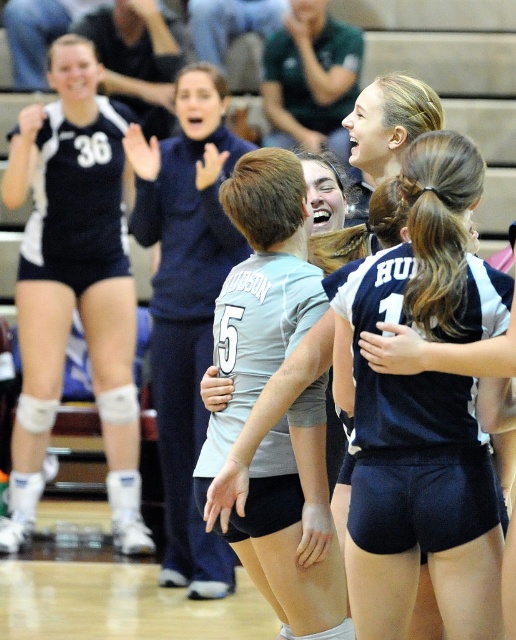
Is matte black uniform at center closer to the viewer compared to matte blue sweatshirt at center?

No, matte black uniform at center is further to the viewer.

The height and width of the screenshot is (640, 516). I want to click on matte black uniform at center, so click(73, 284).

Is point (112, 173) positioned after point (181, 104)?

Yes, it is.

In order to click on matte black uniform at center in this screenshot , I will do `click(73, 284)`.

Does matte black uniform at center appear over light gray jersey at center?

Indeed, matte black uniform at center is positioned over light gray jersey at center.

Does matte black uniform at center have a greater height compared to light gray jersey at center?

Yes.

Does point (27, 374) come behind point (383, 403)?

Yes, point (27, 374) is behind point (383, 403).

At what (x,y) coordinates should I click in order to perform the action: click on matte black uniform at center. Please return your answer as a coordinate pair (x, y). This screenshot has width=516, height=640. Looking at the image, I should click on (73, 284).

This screenshot has height=640, width=516. Identify the location of light gray jersey at center. (421, 304).

Is light gray jersey at center positioned behind matte blue sweatshirt at center?

No.

Identify the location of light gray jersey at center. This screenshot has height=640, width=516. (421, 304).